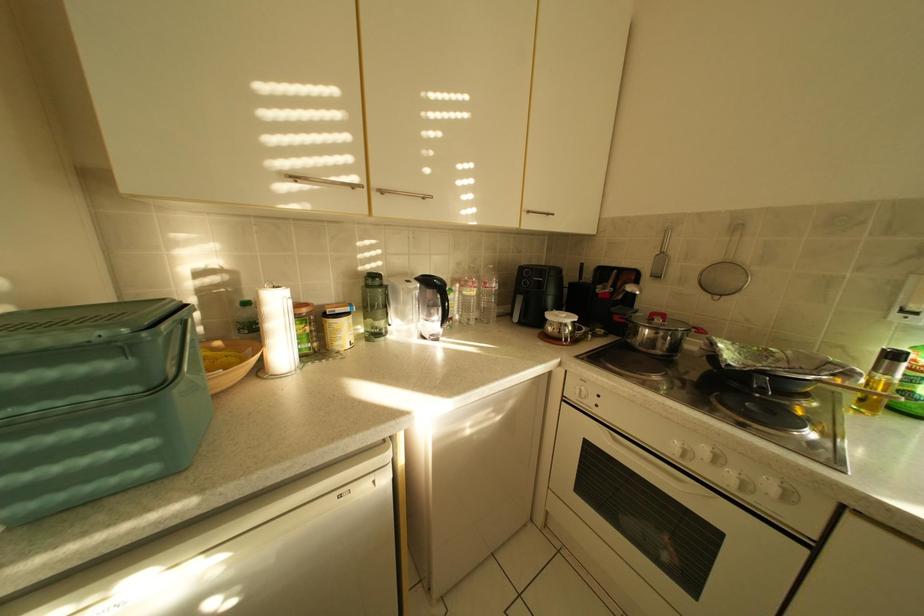
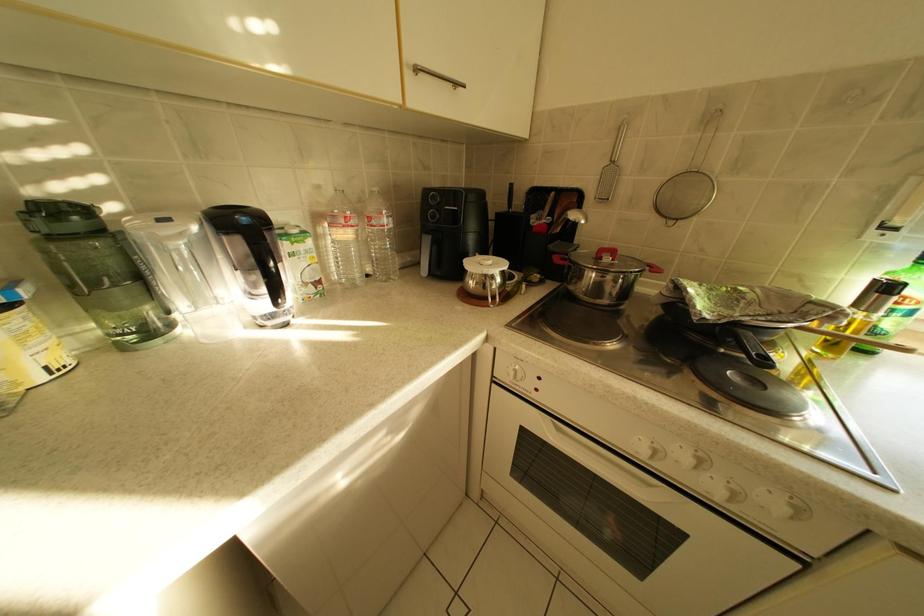
Which direction would the cameraman need to move to produce the second image?

The cameraman walked toward right, forward.